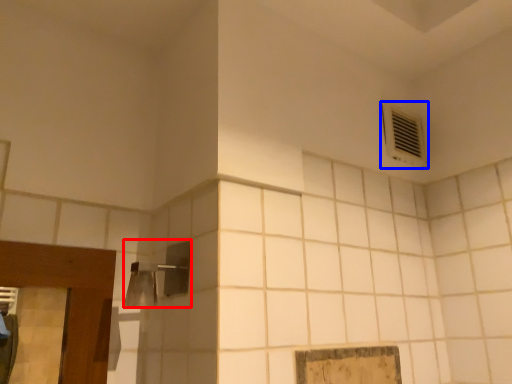
Question: Which object appears closest to the camera in this image, shower (highlighted by a red box) or air conditioning (highlighted by a blue box)?

Choices:
 (A) shower
 (B) air conditioning

Answer: (A)